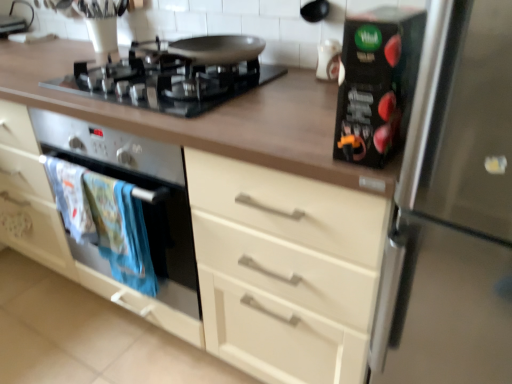
Locate an element on the screen. vacant point to the left of white glossy vase at upper center, marked as the second appliance in a bottom-to-top arrangement is located at coordinates (290, 79).